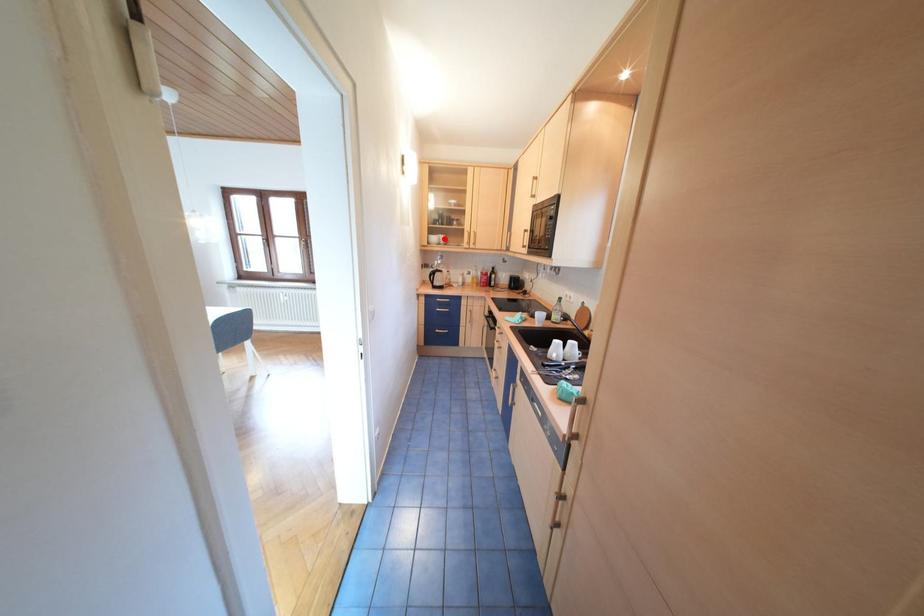
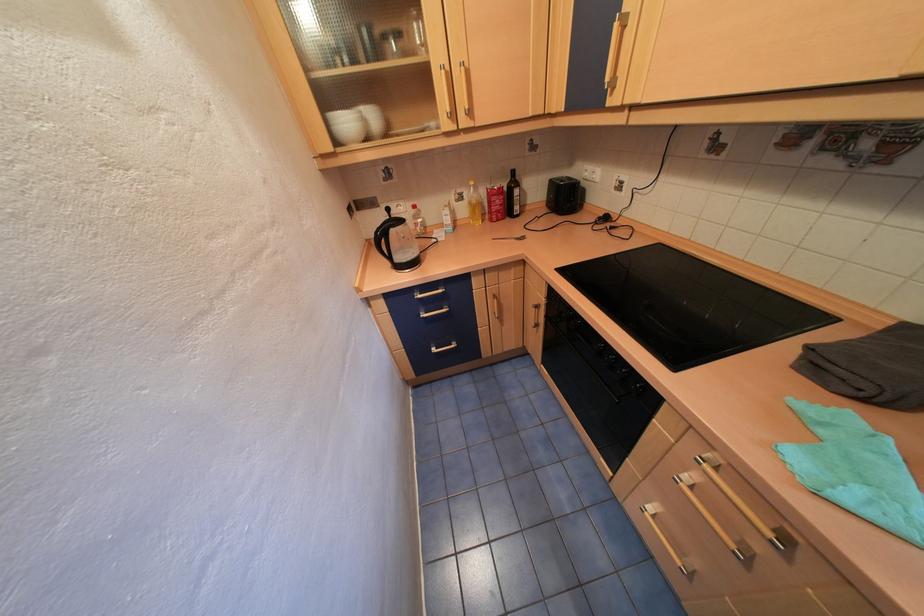
In the second image, find the point that corresponds to the highlighted location in the first image.

(357, 123)